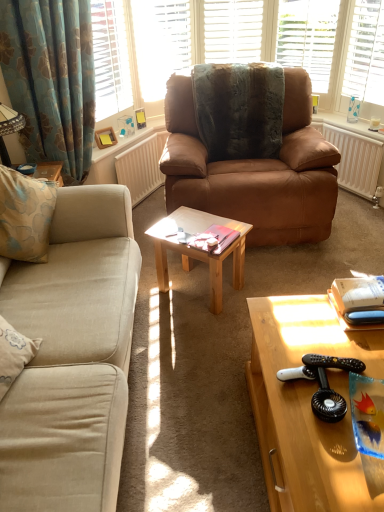
This screenshot has height=512, width=384. I want to click on vacant point above light brown wooden table at center, which ranks as the 1th coffee table in left-to-right order (from a real-world perspective), so click(208, 222).